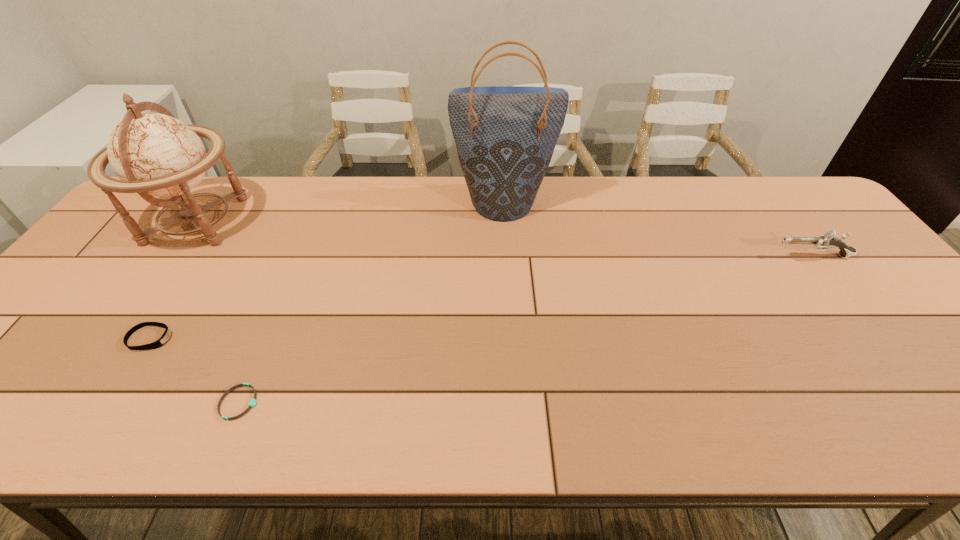
Where is `object at the right edge`? The height and width of the screenshot is (540, 960). object at the right edge is located at coordinates (827, 241).

Locate an element on the screen. object that is at the far left corner is located at coordinates (154, 154).

Where is `free space at the far edge`? The image size is (960, 540). free space at the far edge is located at coordinates (670, 207).

This screenshot has width=960, height=540. Find the location of `vacant region at the near edge of the desktop`. vacant region at the near edge of the desktop is located at coordinates (934, 429).

The width and height of the screenshot is (960, 540). Identify the location of vacant space at the right edge of the desktop. (893, 369).

Identify the location of unoccupied position between the taller wristband and the nearer wristband. (195, 370).

Where is `free spot between the gun and the fourth shortest object`? The width and height of the screenshot is (960, 540). free spot between the gun and the fourth shortest object is located at coordinates (504, 238).

This screenshot has width=960, height=540. Identify the location of free space between the rightmost object and the nearest object. pos(526,329).

Find the location of `vacant area that lies between the farther wristband and the globe`. vacant area that lies between the farther wristband and the globe is located at coordinates (173, 280).

The image size is (960, 540). Identify the location of free space between the third object from right to left and the fourth shortest object. (218, 312).